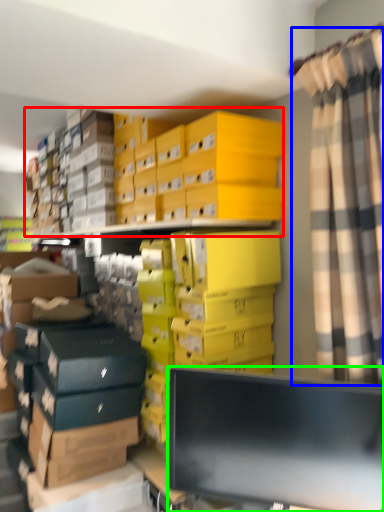
Question: Considering the real-world distances, which object is farthest from storage box (highlighted by a red box)? curtain (highlighted by a blue box) or computer monitor (highlighted by a green box)?

Choices:
 (A) curtain
 (B) computer monitor

Answer: (B)